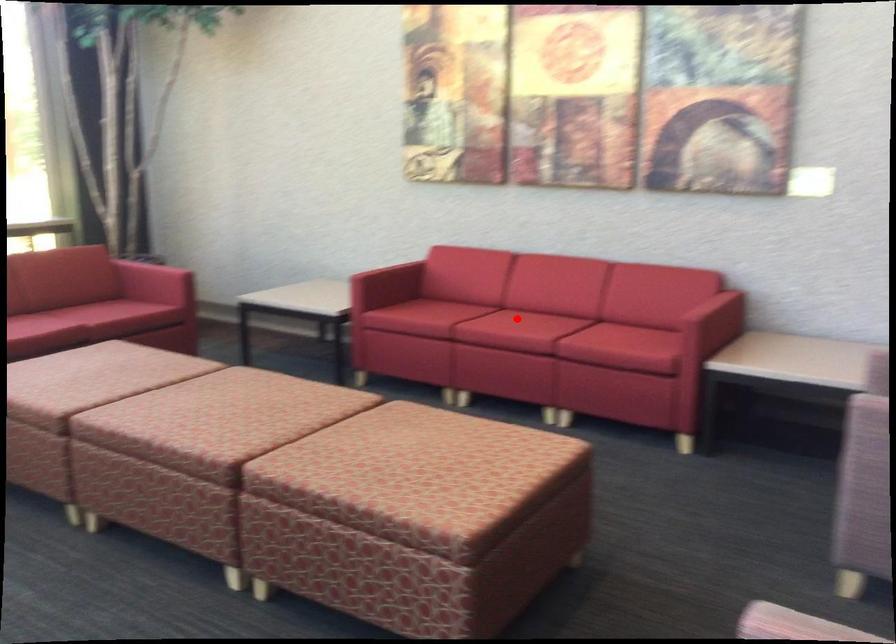
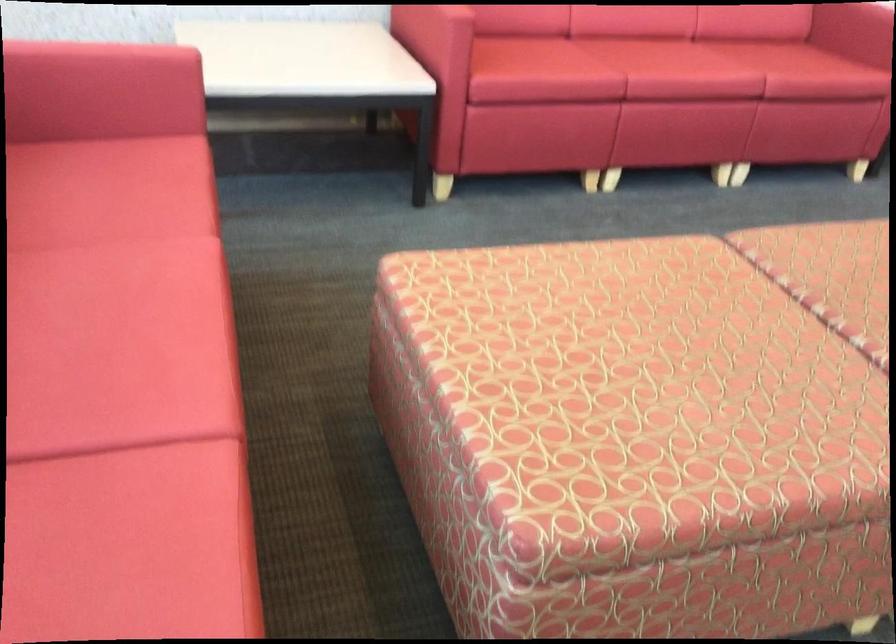
Find the pixel in the second image that matches the highlighted location in the first image.

(677, 62)